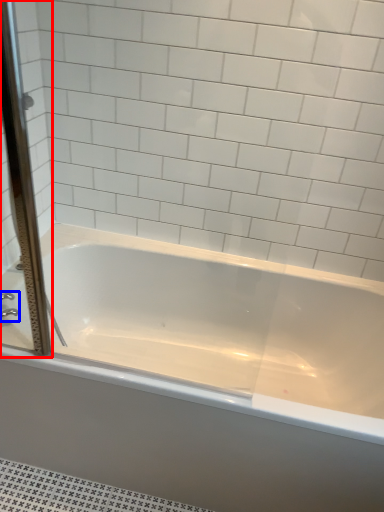
Question: Which object is closer to the camera taking this photo, screen door (highlighted by a red box) or faucet (highlighted by a blue box)?

Choices:
 (A) screen door
 (B) faucet

Answer: (A)